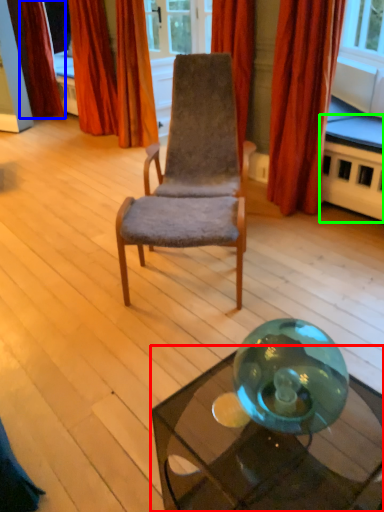
Question: Which is nearer to the table (highlighted by a red box)? curtain (highlighted by a blue box) or table (highlighted by a green box).

Choices:
 (A) curtain
 (B) table

Answer: (B)